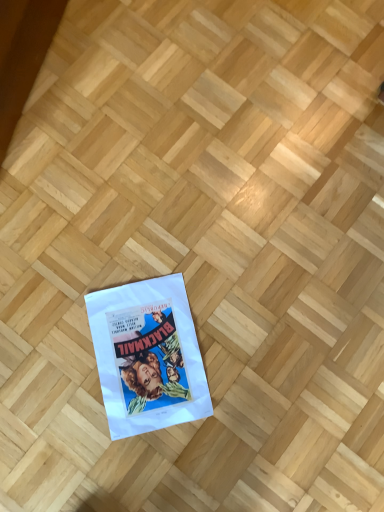
The height and width of the screenshot is (512, 384). What are the coordinates of `vacant space positioned to the left of white paper at center` in the screenshot? It's located at (52, 325).